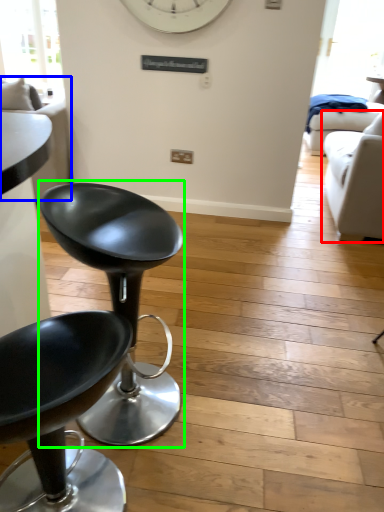
Question: Based on their relative distances, which object is farther from studio couch (highlighted by a red box)? Choose from couch (highlighted by a blue box) and chair (highlighted by a green box).

Choices:
 (A) couch
 (B) chair

Answer: (A)